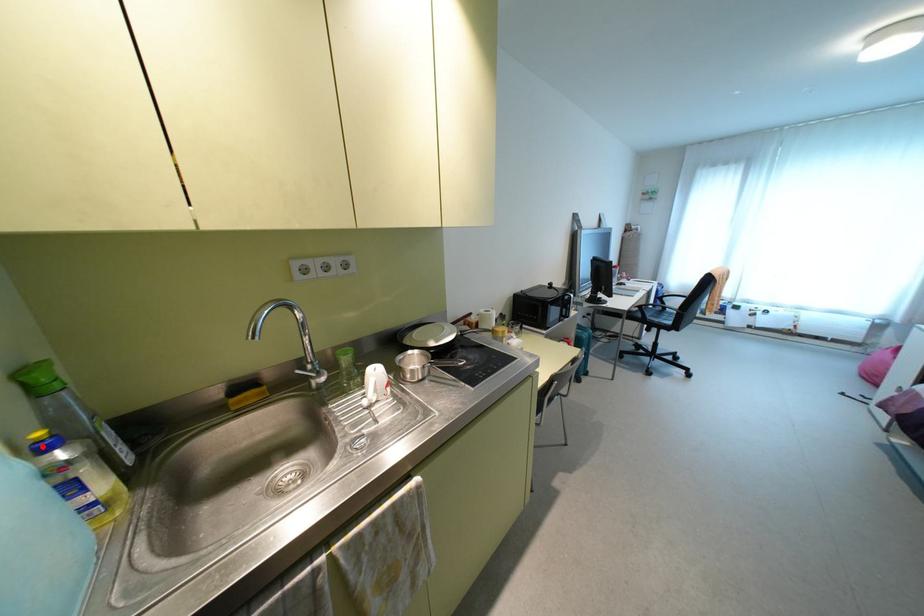
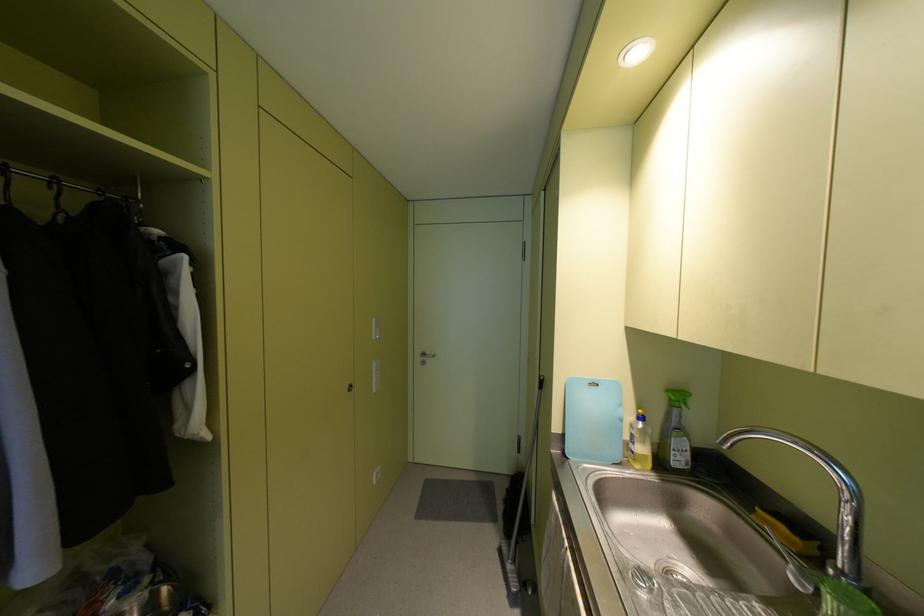
Locate, in the second image, the point that corresponds to the highlighted location in the first image.

(640, 416)